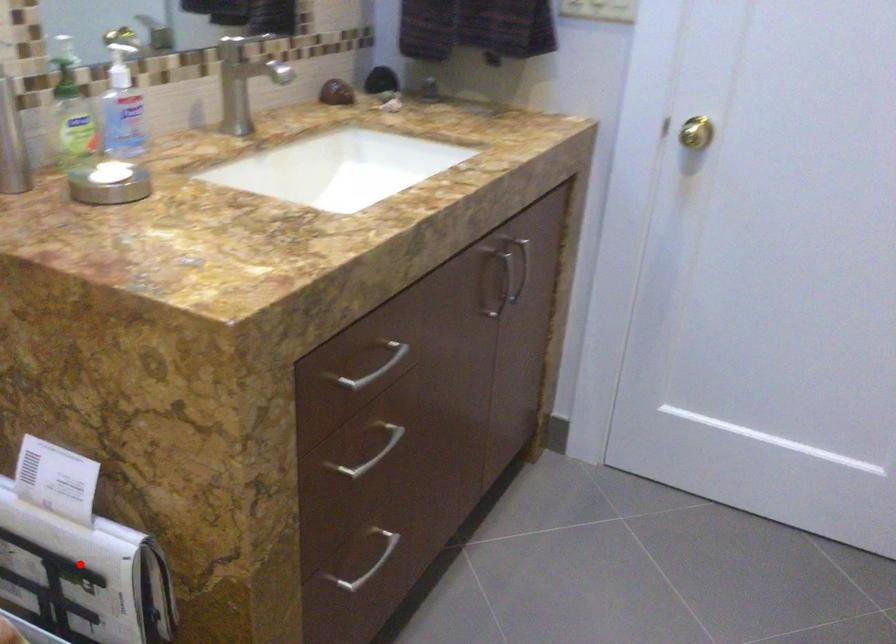
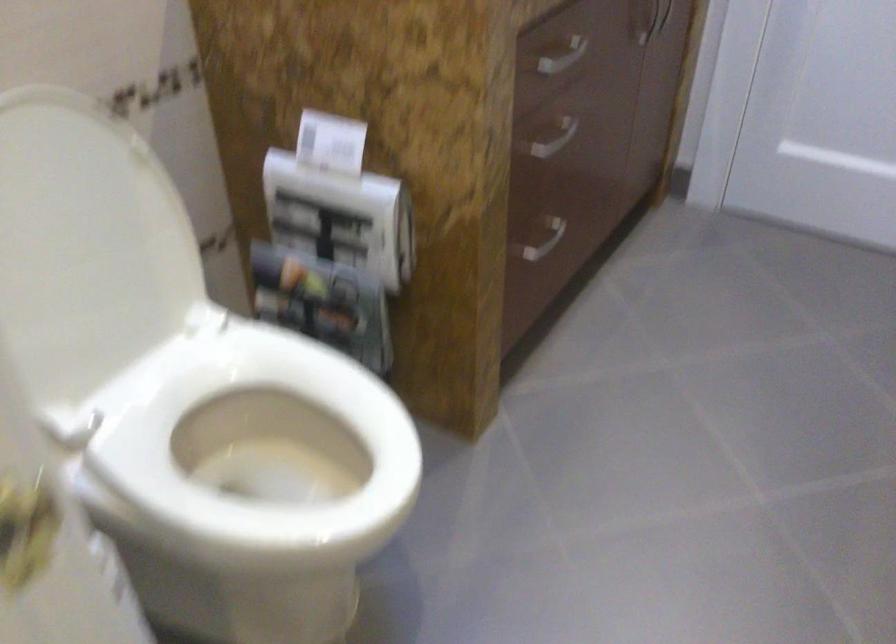
Question: I am providing you with two images of the same scene from different viewpoints. Image1 has a red point marked. In image2, the corresponding 3D location appears at what relative position? Reply with the corresponding letter.

Choices:
 (A) Closer
 (B) Farther

Answer: (B)